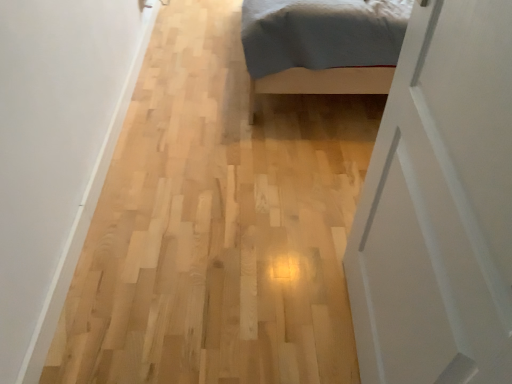
Image resolution: width=512 pixels, height=384 pixels. In order to click on vacant space behind white matte door at right in this screenshot , I will do `click(311, 237)`.